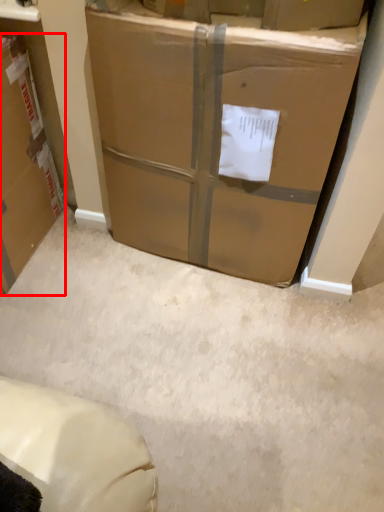
Question: From the image's perspective, what is the correct spatial relationship of box (annotated by the red box) in relation to box?

Choices:
 (A) below
 (B) above

Answer: (A)